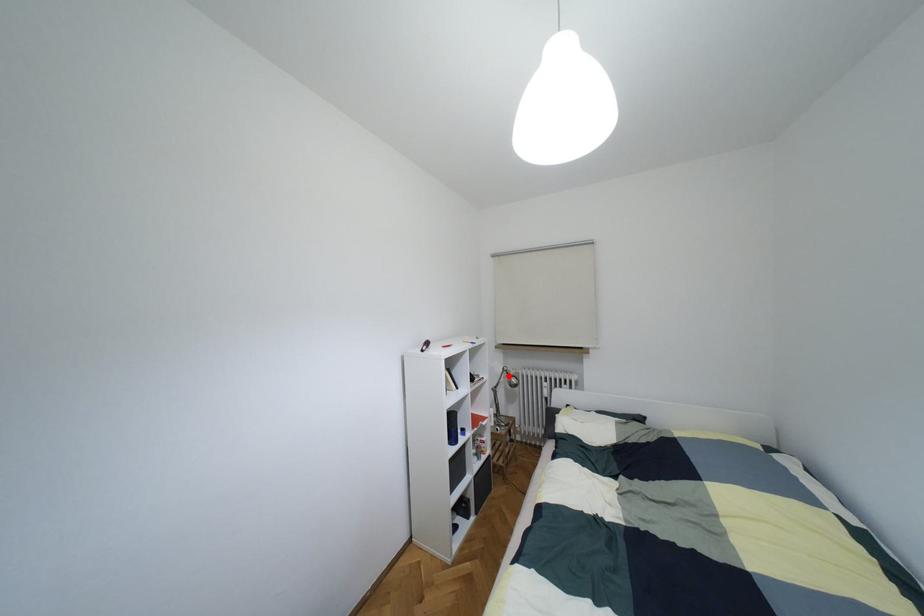
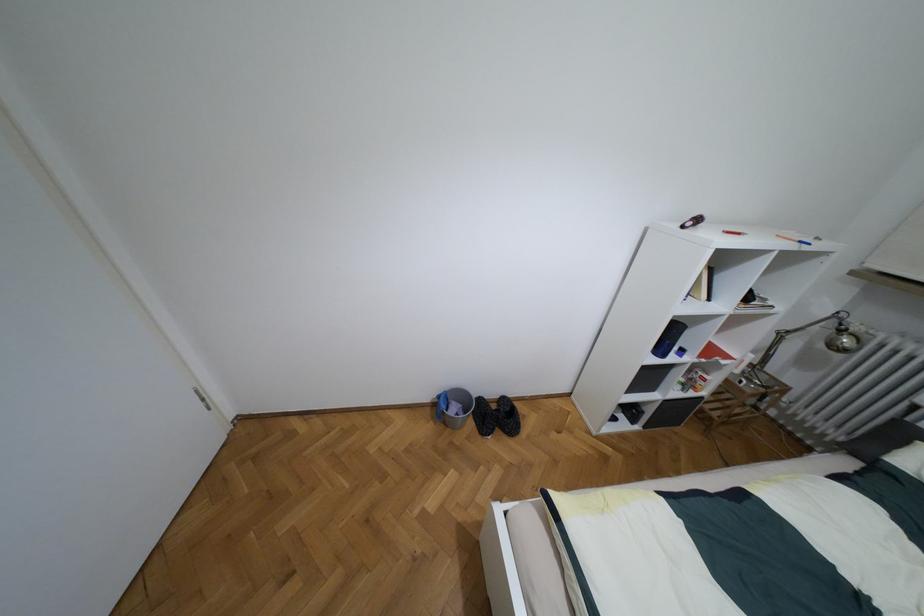
Locate, in the second image, the point that corresponds to the highlighted location in the first image.

(840, 330)